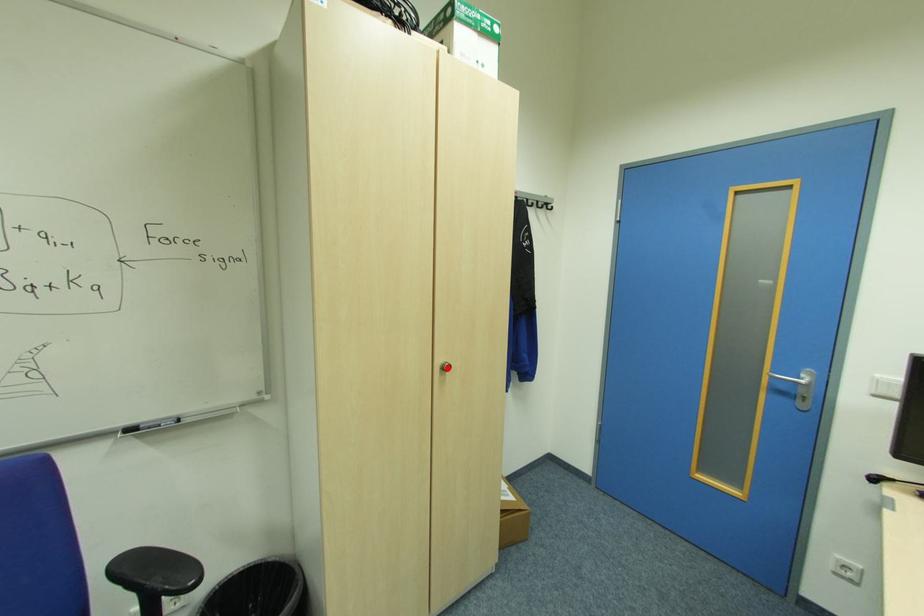
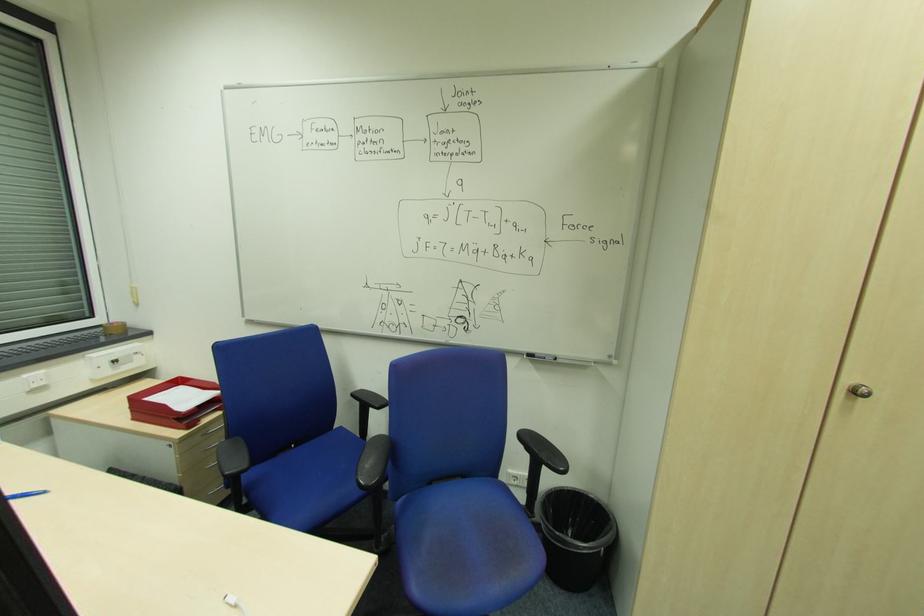
Locate, in the second image, the point that corresponds to the highlighted location in the first image.

(860, 392)